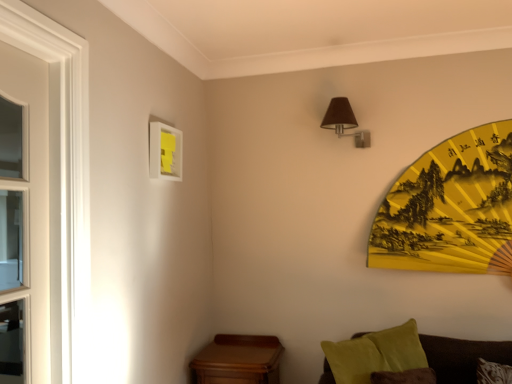
Question: Is yellow paper fan at upper right at the back of brown fabric lampshade at upper right?

Choices:
 (A) yes
 (B) no

Answer: (B)

Question: Can you confirm if brown fabric lampshade at upper right is shorter than yellow paper fan at upper right?

Choices:
 (A) no
 (B) yes

Answer: (B)

Question: Is brown fabric lampshade at upper right surrounding yellow paper fan at upper right?

Choices:
 (A) no
 (B) yes

Answer: (A)

Question: Would you say brown fabric lampshade at upper right is outside yellow paper fan at upper right?

Choices:
 (A) yes
 (B) no

Answer: (A)

Question: Can you confirm if brown fabric lampshade at upper right is bigger than yellow paper fan at upper right?

Choices:
 (A) yes
 (B) no

Answer: (B)

Question: In terms of size, does brown fabric lampshade at upper right appear bigger or smaller than white matte picture frame at upper left?

Choices:
 (A) small
 (B) big

Answer: (B)

Question: From a real-world perspective, relative to white matte picture frame at upper left, is brown fabric lampshade at upper right vertically above or below?

Choices:
 (A) below
 (B) above

Answer: (B)

Question: Which is correct: brown fabric lampshade at upper right is inside white matte picture frame at upper left, or outside of it?

Choices:
 (A) outside
 (B) inside

Answer: (A)

Question: Is point (362, 139) positioned closer to the camera than point (148, 163)?

Choices:
 (A) farther
 (B) closer

Answer: (A)

Question: From a real-world perspective, is white matte picture frame at upper left above or below brown fabric lampshade at upper right?

Choices:
 (A) above
 (B) below

Answer: (B)

Question: Does point (176, 160) appear closer or farther from the camera than point (343, 130)?

Choices:
 (A) closer
 (B) farther

Answer: (A)

Question: Relative to brown fabric lampshade at upper right, is white matte picture frame at upper left in front or behind?

Choices:
 (A) front
 (B) behind

Answer: (A)

Question: Is white matte picture frame at upper left spatially inside brown fabric lampshade at upper right, or outside of it?

Choices:
 (A) outside
 (B) inside

Answer: (A)

Question: In terms of height, does brown fabric lampshade at upper right look taller or shorter compared to yellow paper fan at upper right?

Choices:
 (A) short
 (B) tall

Answer: (A)

Question: Based on their positions, is brown fabric lampshade at upper right located to the left or right of yellow paper fan at upper right?

Choices:
 (A) left
 (B) right

Answer: (A)